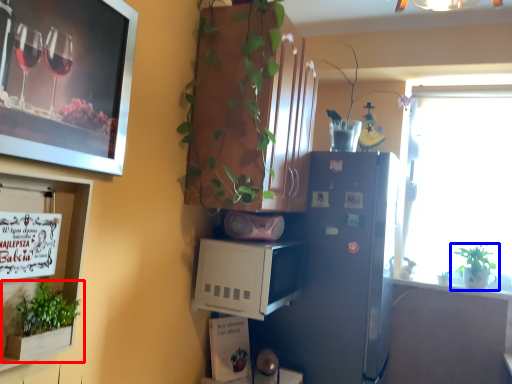
Question: Which of the following is the farthest to the observer, houseplant (highlighted by a red box) or houseplant (highlighted by a blue box)?

Choices:
 (A) houseplant
 (B) houseplant

Answer: (B)